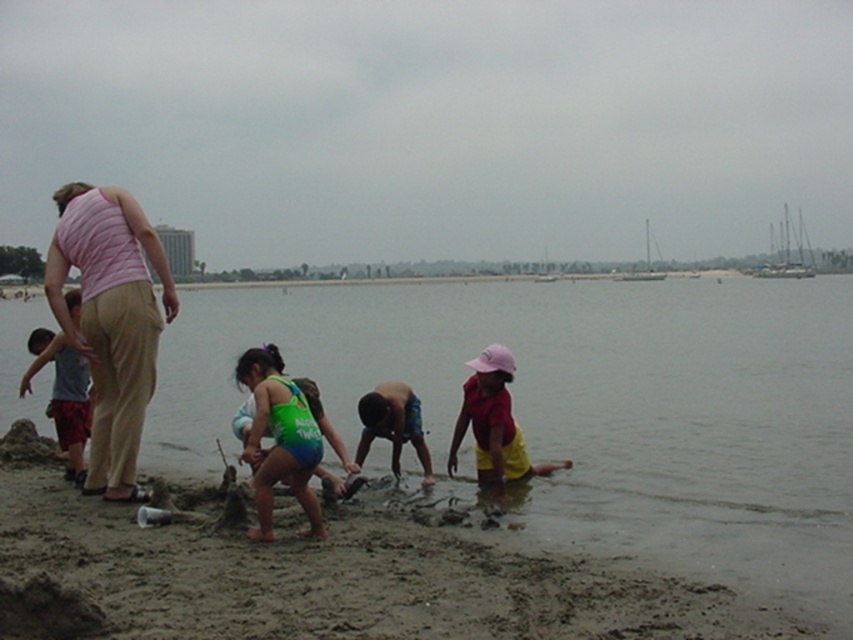
Question: Is pink striped shirt at upper left positioned in front of multicolored striped shorts at center?

Choices:
 (A) yes
 (B) no

Answer: (A)

Question: Is pink fabric hat at lower center bigger than multicolored striped shorts at center?

Choices:
 (A) yes
 (B) no

Answer: (A)

Question: Which is farther from the clear water at lower left?

Choices:
 (A) green swimsuit at center
 (B) matte gray shirt at left
 (C) multicolored striped shorts at center

Answer: (C)

Question: Which point is closer to the camera taking this photo?

Choices:
 (A) (x=288, y=467)
 (B) (x=82, y=476)
 (C) (x=596, y=385)

Answer: (A)

Question: Which object is the closest to the green swimsuit at center?

Choices:
 (A) matte gray shirt at left
 (B) clear water at lower left

Answer: (A)

Question: Can you confirm if clear water at lower left is bigger than matte gray shirt at left?

Choices:
 (A) yes
 (B) no

Answer: (A)